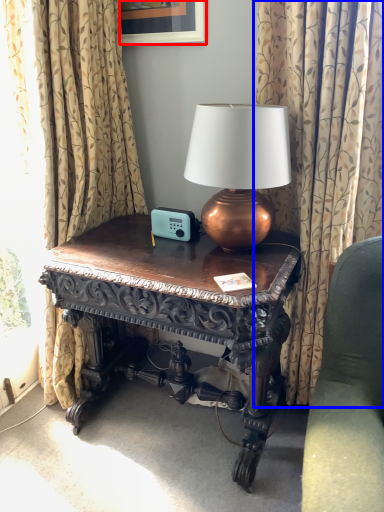
Question: Which of the following is the farthest to the observer, picture frame (highlighted by a red box) or curtain (highlighted by a blue box)?

Choices:
 (A) picture frame
 (B) curtain

Answer: (A)